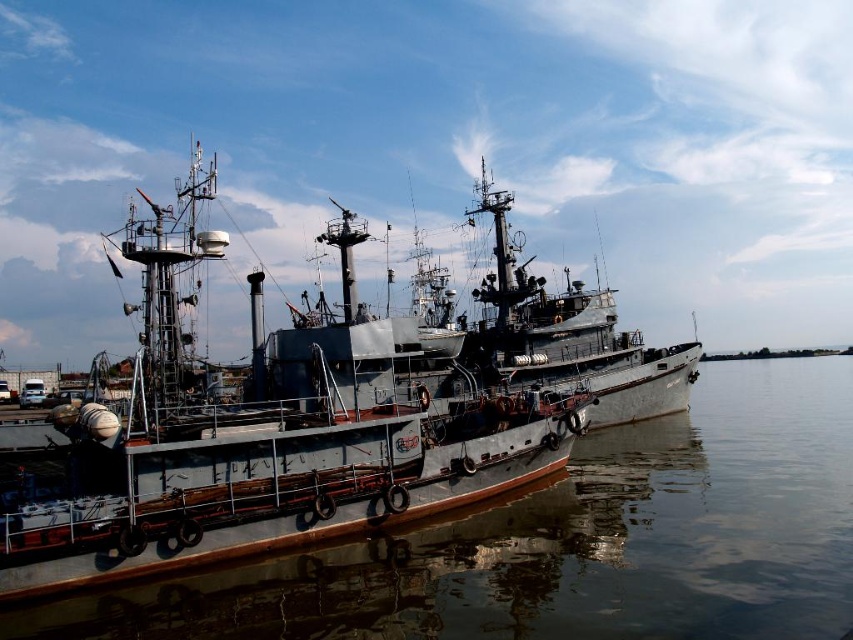
What do you see at coordinates (570, 541) in the screenshot? I see `smooth gray water at center` at bounding box center [570, 541].

Is point (792, 362) farther from viewer compared to point (547, 300)?

Yes.

Where is `smooth gray water at center`? This screenshot has width=853, height=640. smooth gray water at center is located at coordinates (570, 541).

From the picture: Between gray metallic ship at center and rusty metal ship at center, which one is positioned lower?

rusty metal ship at center

Does gray metallic ship at center lie in front of rusty metal ship at center?

Yes, it is in front of rusty metal ship at center.

You are a GUI agent. You are given a task and a screenshot of the screen. Output one action in this format:
    pyautogui.click(x=<x>, y=<y>)
    Task: Click on the gray metallic ship at center
    Image resolution: width=853 pixels, height=640 pixels.
    Given the screenshot: What is the action you would take?
    pyautogui.click(x=256, y=436)

Identify the location of smooth gray water at center. This screenshot has height=640, width=853. (570, 541).

Is smooth gray water at center bigger than gray metallic ship at center?

No, smooth gray water at center is not bigger than gray metallic ship at center.

Does point (850, 392) come farther from viewer compared to point (231, 531)?

Yes, point (850, 392) is behind point (231, 531).

The width and height of the screenshot is (853, 640). I want to click on smooth gray water at center, so click(570, 541).